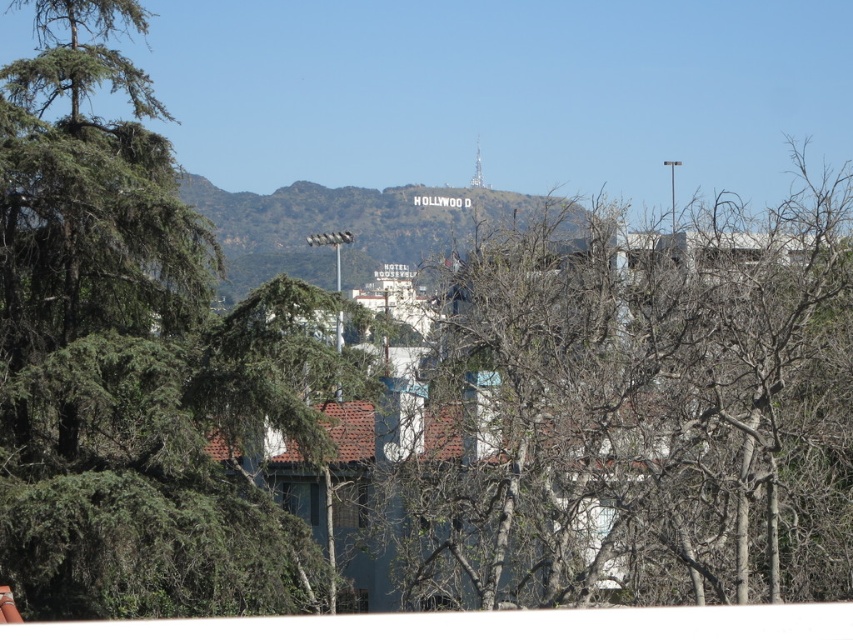
Question: In this image, where is bare branches at center located relative to green leafy tree at left?

Choices:
 (A) above
 (B) below

Answer: (B)

Question: Is green leafy tree at left to the right of white stone hollywood sign at center from the viewer's perspective?

Choices:
 (A) yes
 (B) no

Answer: (B)

Question: Which of the following is the closest to the observer?

Choices:
 (A) bare branches at center
 (B) green leafy tree at left
 (C) white stone hollywood sign at center

Answer: (A)

Question: Which point appears farthest from the camera in this image?

Choices:
 (A) (831, 563)
 (B) (212, 580)
 (C) (540, 211)

Answer: (C)

Question: Which of these objects is positioned farthest from the white stone hollywood sign at center?

Choices:
 (A) bare branches at center
 (B) green leafy tree at left

Answer: (A)

Question: Is bare branches at center closer to the viewer compared to green leafy tree at left?

Choices:
 (A) yes
 (B) no

Answer: (A)